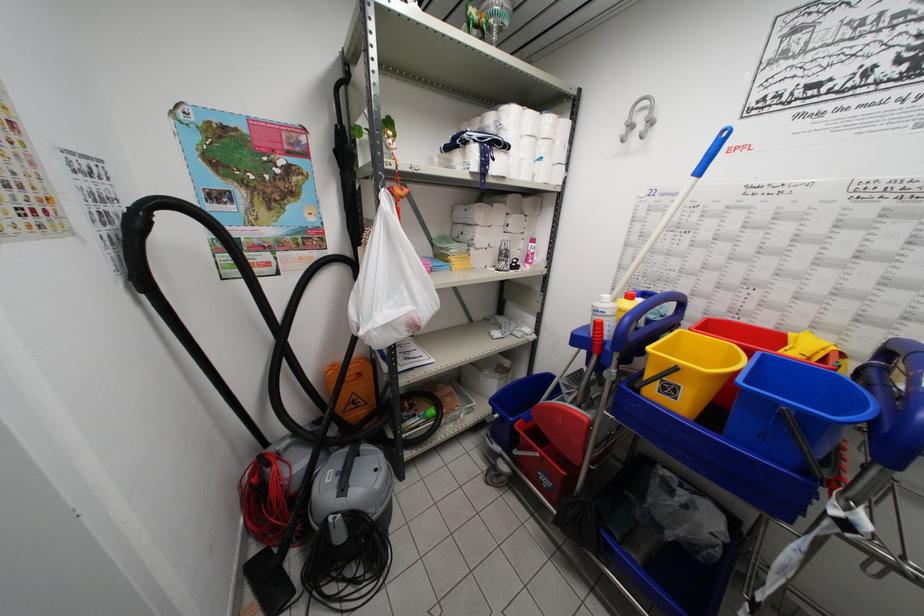
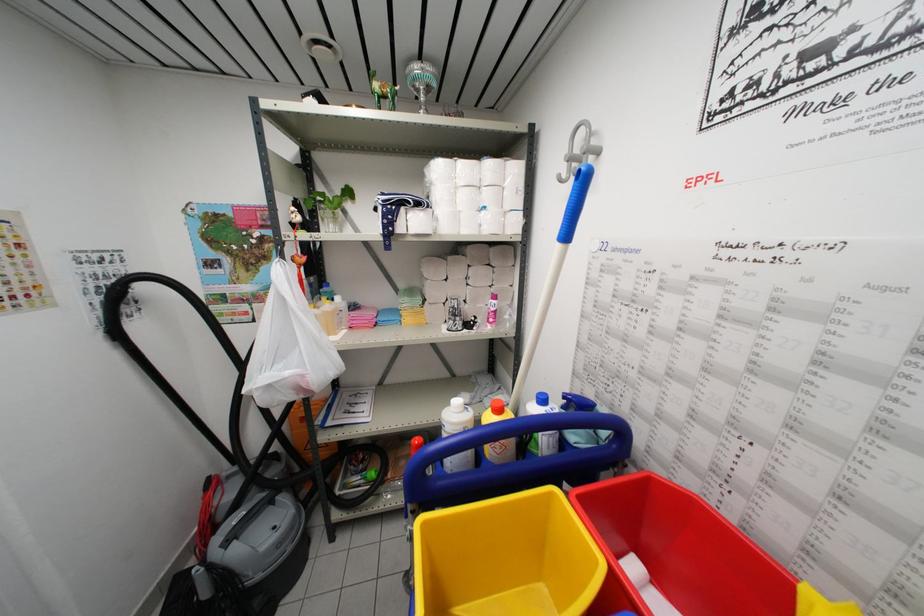
Where in the second image is the point corresponding to point 381,331 from the first image?

(258, 392)